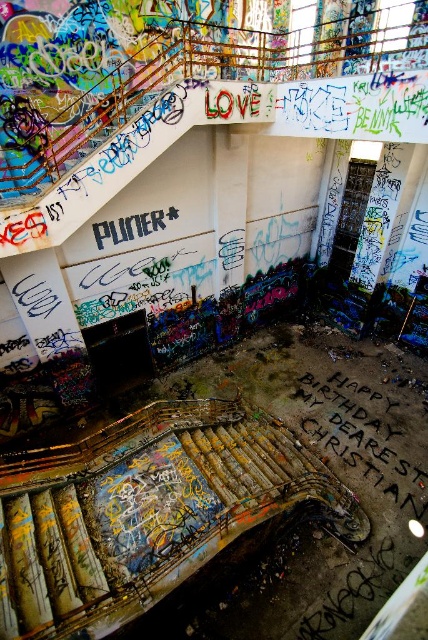
Question: Among these objects, which one is farthest from the camera?

Choices:
 (A) black chalk writing at center
 (B) rusty metal stairs at center

Answer: (A)

Question: From the image, what is the correct spatial relationship of rusty metal stairs at center in relation to black chalk writing at center?

Choices:
 (A) right
 (B) left

Answer: (B)

Question: Can you confirm if rusty metal stairs at center is positioned below black chalk writing at center?

Choices:
 (A) no
 (B) yes

Answer: (A)

Question: Among these points, which one is farthest from the camera?

Choices:
 (A) (326, 499)
 (B) (380, 461)

Answer: (B)

Question: Which of the following is the closest to the observer?

Choices:
 (A) (401, 470)
 (B) (172, 497)

Answer: (B)

Question: Does rusty metal stairs at center have a smaller size compared to black chalk writing at center?

Choices:
 (A) yes
 (B) no

Answer: (A)